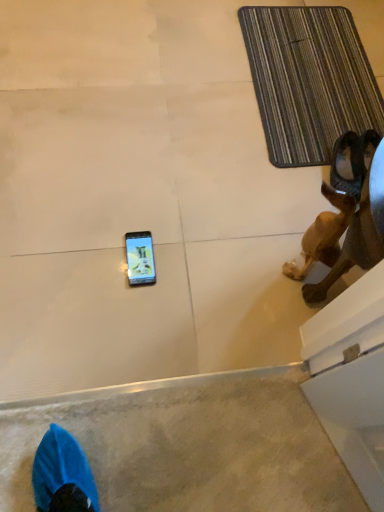
The height and width of the screenshot is (512, 384). Identify the location of free space in front of striped fabric bath mat at upper right. (223, 203).